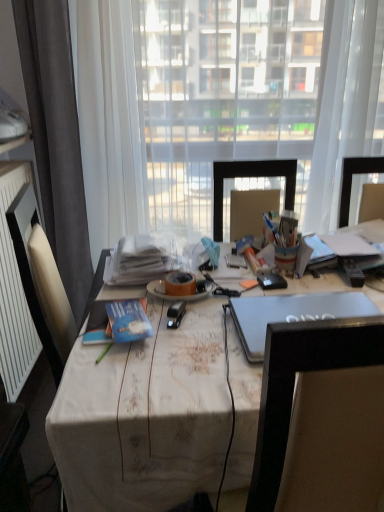
At what (x,y) coordinates should I click in order to perform the action: click on free point above sleek silver laptop at center (from a real-world perspective). Please return your answer as a coordinate pair (x, y). This screenshot has width=384, height=512. Looking at the image, I should click on (308, 306).